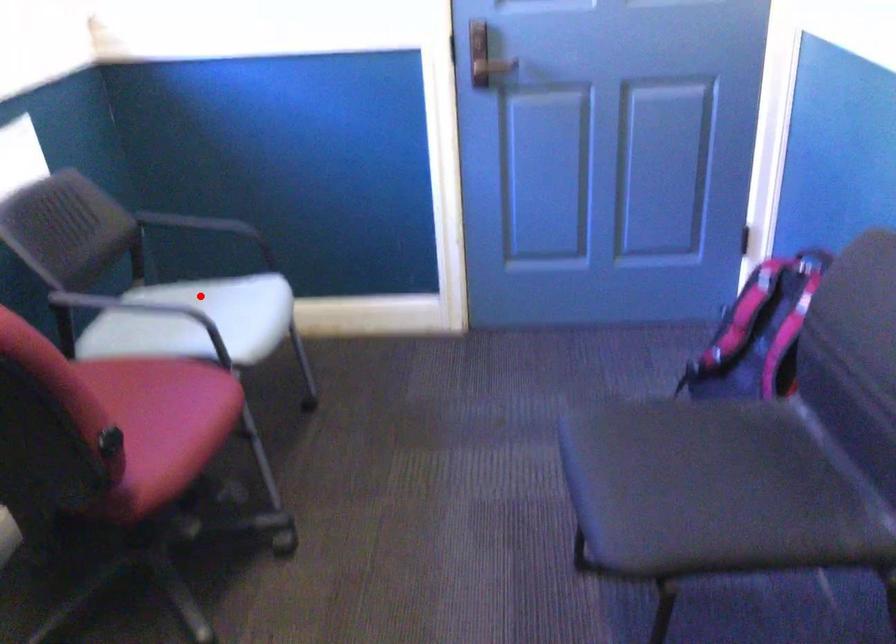
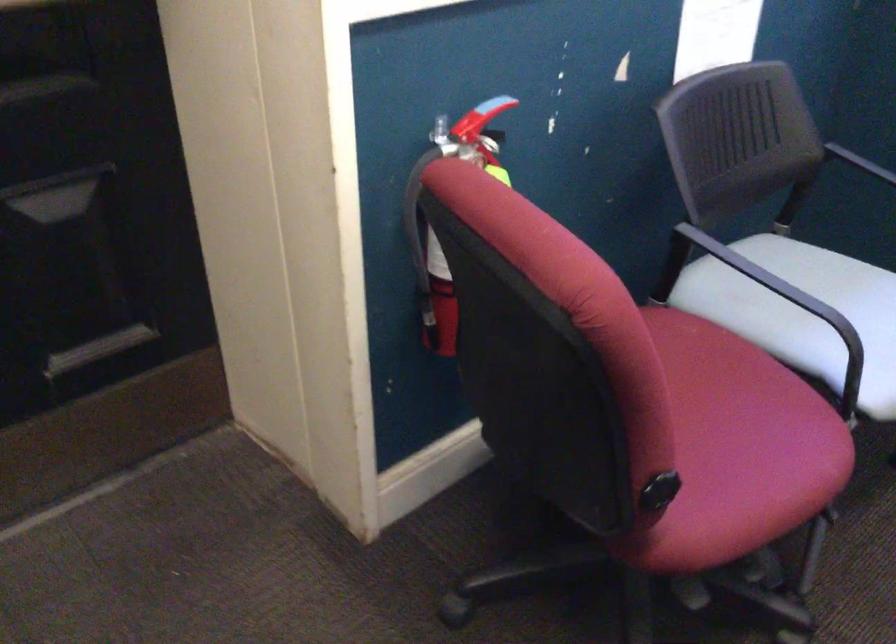
Locate, in the second image, the point that corresponds to the highlighted location in the first image.

(842, 276)